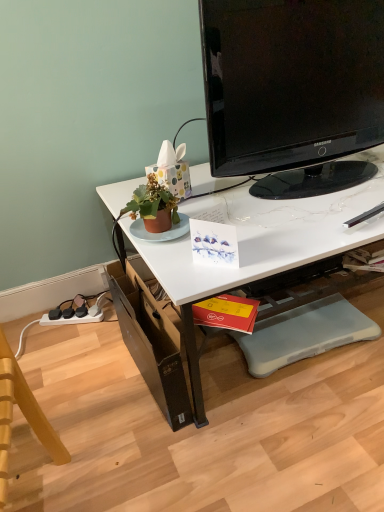
This screenshot has width=384, height=512. In order to click on blank space situated above gray rubber footrest at lower center (from a real-world perspective) in this screenshot , I will do `click(300, 330)`.